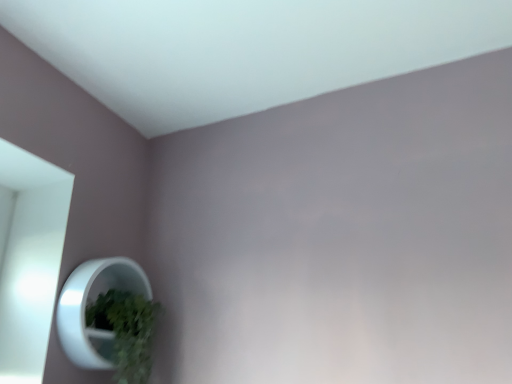
Question: Considering the positions of green matte plant at lower left and white glossy mirror at lower left in the image, is green matte plant at lower left taller or shorter than white glossy mirror at lower left?

Choices:
 (A) tall
 (B) short

Answer: (B)

Question: From the image's perspective, relative to white glossy mirror at lower left, is green matte plant at lower left above or below?

Choices:
 (A) above
 (B) below

Answer: (B)

Question: Is green matte plant at lower left wider or thinner than white glossy mirror at lower left?

Choices:
 (A) thin
 (B) wide

Answer: (B)

Question: From the image's perspective, relative to green matte plant at lower left, is white glossy mirror at lower left above or below?

Choices:
 (A) above
 (B) below

Answer: (A)

Question: From their relative heights in the image, would you say white glossy mirror at lower left is taller or shorter than green matte plant at lower left?

Choices:
 (A) short
 (B) tall

Answer: (B)

Question: Is white glossy mirror at lower left situated inside green matte plant at lower left or outside?

Choices:
 (A) inside
 (B) outside

Answer: (A)

Question: Is white glossy mirror at lower left wider or thinner than green matte plant at lower left?

Choices:
 (A) wide
 (B) thin

Answer: (B)